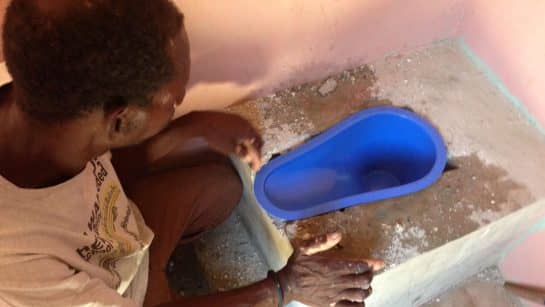
Identify the location of white walls. This screenshot has height=307, width=545. (522, 53).